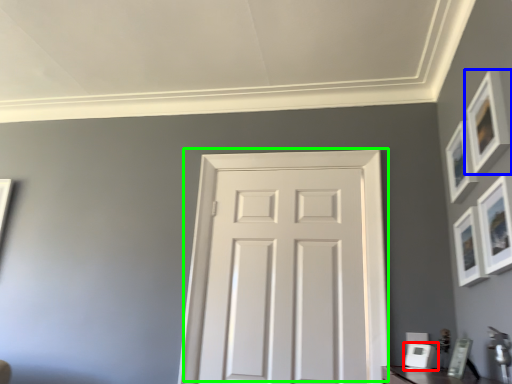
Question: Which is nearer to the picture frame (highlighted by a red box)? picture frame (highlighted by a blue box) or door (highlighted by a green box).

Choices:
 (A) picture frame
 (B) door

Answer: (B)